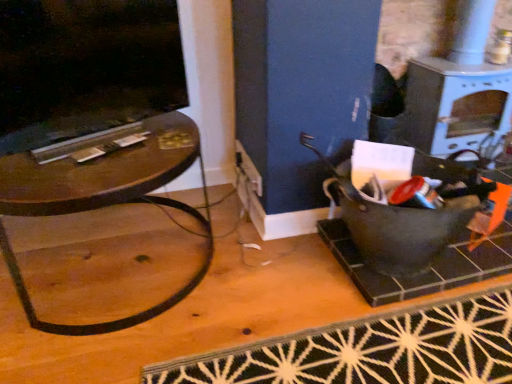
Question: Is black woven mat at lower center not near white glossy stove at upper right?

Choices:
 (A) no
 (B) yes

Answer: (A)

Question: Is black woven mat at lower center at the left side of white glossy stove at upper right?

Choices:
 (A) yes
 (B) no

Answer: (A)

Question: Does black woven mat at lower center have a greater height compared to white glossy stove at upper right?

Choices:
 (A) yes
 (B) no

Answer: (B)

Question: Considering the relative sizes of black woven mat at lower center and white glossy stove at upper right in the image provided, is black woven mat at lower center shorter than white glossy stove at upper right?

Choices:
 (A) no
 (B) yes

Answer: (B)

Question: Does black woven mat at lower center contain white glossy stove at upper right?

Choices:
 (A) no
 (B) yes

Answer: (A)

Question: From the image's perspective, is black woven mat at lower center above or below white glossy stove at upper right?

Choices:
 (A) above
 (B) below

Answer: (B)

Question: In terms of size, does black woven mat at lower center appear bigger or smaller than white glossy stove at upper right?

Choices:
 (A) small
 (B) big

Answer: (A)

Question: Considering the positions of black woven mat at lower center and white glossy stove at upper right in the image, is black woven mat at lower center taller or shorter than white glossy stove at upper right?

Choices:
 (A) tall
 (B) short

Answer: (B)

Question: Is black woven mat at lower center wider or thinner than white glossy stove at upper right?

Choices:
 (A) thin
 (B) wide

Answer: (B)

Question: Relative to white glossy stove at upper right, is brown wood table at left in front or behind?

Choices:
 (A) behind
 (B) front

Answer: (B)

Question: From the image's perspective, is brown wood table at left located above or below white glossy stove at upper right?

Choices:
 (A) below
 (B) above

Answer: (A)

Question: Is brown wood table at left to the left or to the right of white glossy stove at upper right in the image?

Choices:
 (A) right
 (B) left

Answer: (B)

Question: Based on their sizes in the image, would you say brown wood table at left is bigger or smaller than white glossy stove at upper right?

Choices:
 (A) small
 (B) big

Answer: (B)

Question: Is black glossy fireplace at upper left wider or thinner than black woven mat at lower center?

Choices:
 (A) wide
 (B) thin

Answer: (B)

Question: From their relative heights in the image, would you say black glossy fireplace at upper left is taller or shorter than black woven mat at lower center?

Choices:
 (A) tall
 (B) short

Answer: (A)